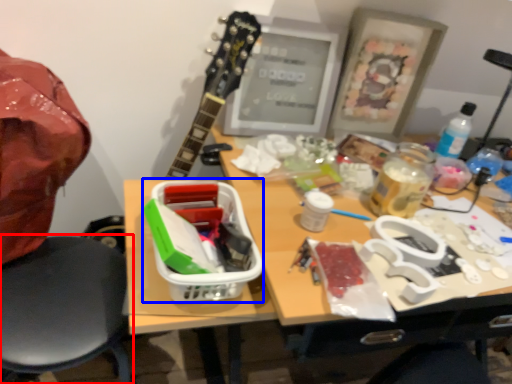
Question: Which point is further to the camera, chair (highlighted by a red box) or lunch box (highlighted by a blue box)?

Choices:
 (A) chair
 (B) lunch box

Answer: (B)